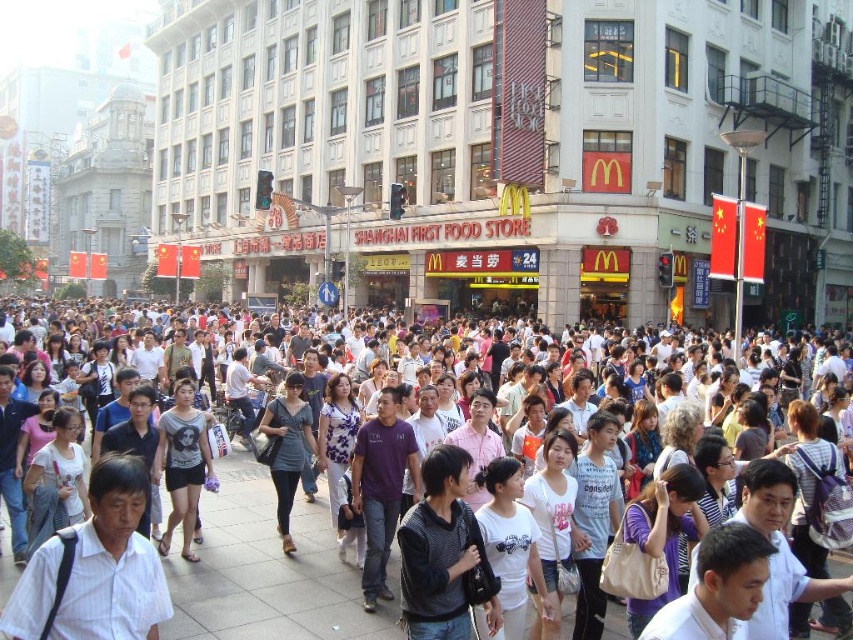
Is dark gray sweater at center above matte gray dress at center?

No.

Identify the location of dark gray sweater at center. (444, 554).

Is matte gray t-shirt at center above matte gray dress at center?

Incorrect, matte gray t-shirt at center is not positioned above matte gray dress at center.

Identify the location of matte gray t-shirt at center. (183, 465).

This screenshot has width=853, height=640. Identify the location of matte gray t-shirt at center. (183, 465).

Consider the image. Can you confirm if purple cotton shirt at center is positioned above matte gray t-shirt at center?

Correct, purple cotton shirt at center is located above matte gray t-shirt at center.

From the picture: Is purple cotton shirt at center bigger than matte gray t-shirt at center?

Yes.

Is point (369, 442) in front of point (186, 390)?

Yes, point (369, 442) is in front of point (186, 390).

At what (x,y) coordinates should I click in order to perform the action: click on purple cotton shirt at center. Please return your answer as a coordinate pair (x, y). This screenshot has height=640, width=853. Looking at the image, I should click on (381, 486).